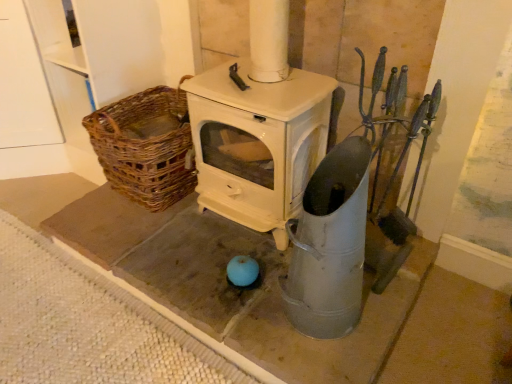
Where is `blank space to the left of metallic gray bucket at center`? The image size is (512, 384). blank space to the left of metallic gray bucket at center is located at coordinates 247,312.